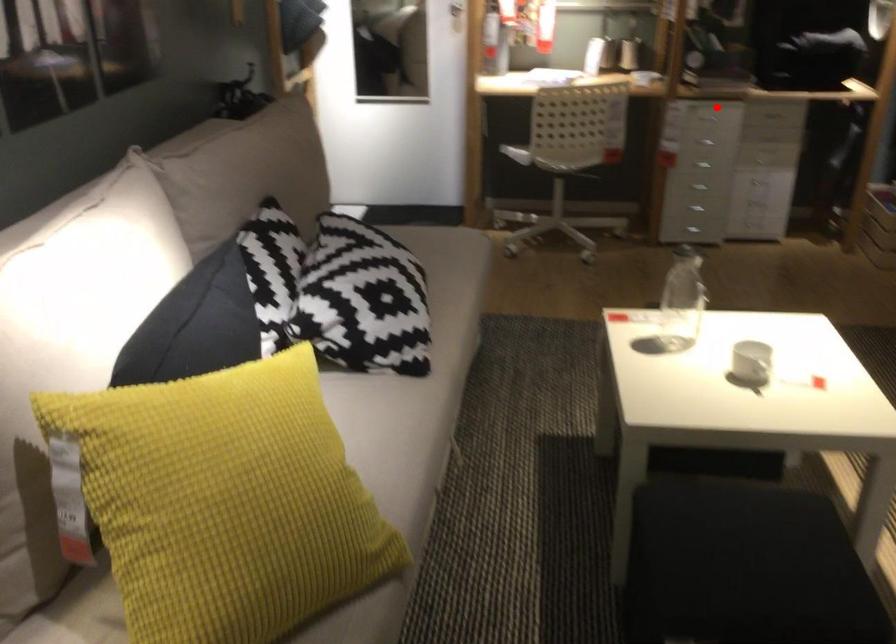
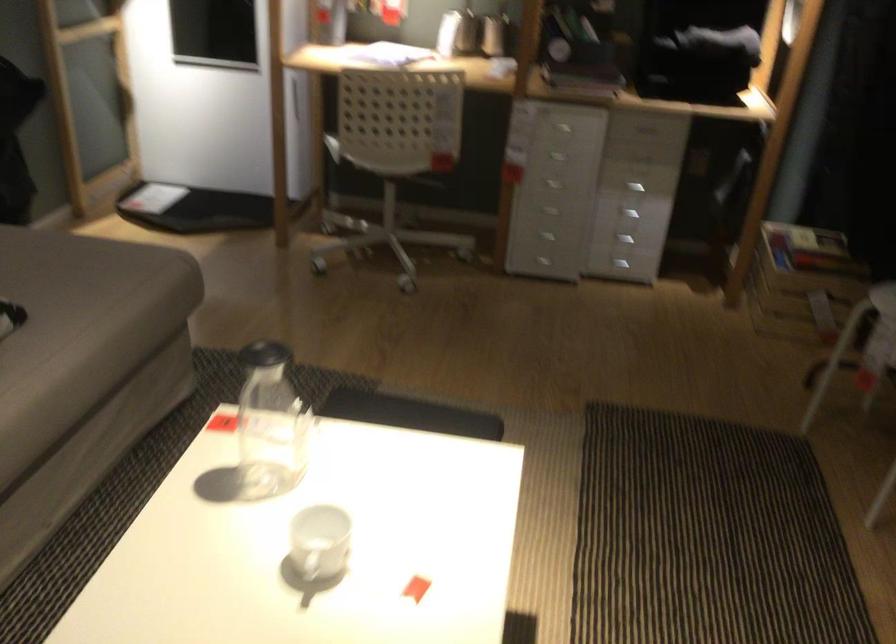
Question: A red point is marked in image1. In image2, is the corresponding 3D point closer to the camera or farther? Reply with the corresponding letter.

Choices:
 (A) The corresponding 3D point is closer.
 (B) The corresponding 3D point is farther.

Answer: (A)